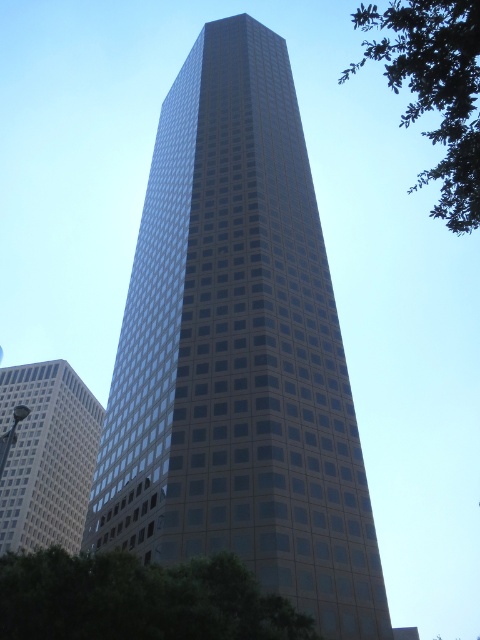
Question: Considering the real-world distances, which object is farthest from the green leafy tree at lower left?

Choices:
 (A) green leafy tree at upper right
 (B) glassy reflective skyscraper at center
 (C) white glass building at left

Answer: (C)

Question: Is green leafy tree at lower left thinner than white glass building at left?

Choices:
 (A) yes
 (B) no

Answer: (A)

Question: Is glassy reflective skyscraper at center to the right of green leafy tree at lower left from the viewer's perspective?

Choices:
 (A) no
 (B) yes

Answer: (A)

Question: Observing the image, what is the correct spatial positioning of glassy reflective skyscraper at center in reference to green leafy tree at upper right?

Choices:
 (A) left
 (B) right

Answer: (A)

Question: Which of the following is the closest to the observer?

Choices:
 (A) (399, 17)
 (B) (288, 257)
 (C) (96, 608)
 (D) (2, 486)

Answer: (A)

Question: Which point is closer to the camera?

Choices:
 (A) green leafy tree at upper right
 (B) white glass building at left
 (C) green leafy tree at lower left

Answer: (A)